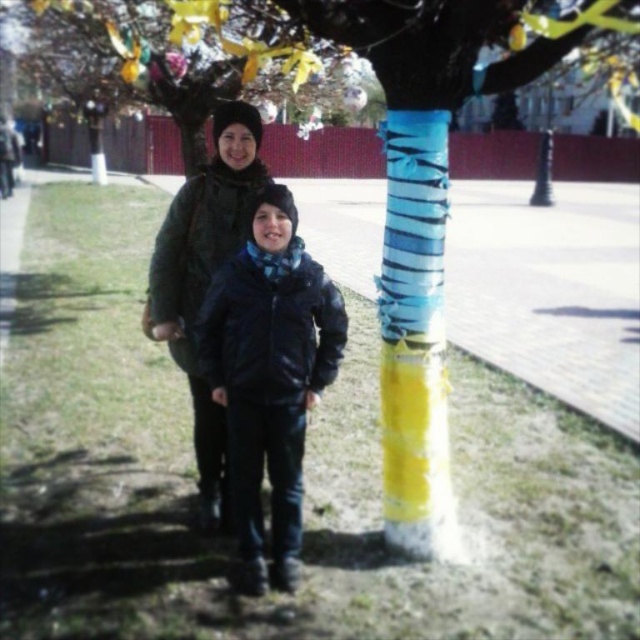
Between decorative painted tree trunk at center and glossy black jacket at center, which one is positioned lower?

Positioned lower is glossy black jacket at center.

Is point (196, 138) closer to camera compared to point (227, 438)?

No, it is behind (227, 438).

Who is more forward, (376, 170) or (291, 452)?

Point (291, 452) is more forward.

Locate an element on the screen. The height and width of the screenshot is (640, 640). decorative painted tree trunk at center is located at coordinates (196, 77).

Describe the element at coordinates (196, 77) in the screenshot. The image size is (640, 640). I see `decorative painted tree trunk at center` at that location.

Looking at this image, can you confirm if decorative painted tree trunk at center is positioned below matte black jacket at center?

Incorrect, decorative painted tree trunk at center is not positioned below matte black jacket at center.

At what (x,y) coordinates should I click in order to perform the action: click on decorative painted tree trunk at center. Please return your answer as a coordinate pair (x, y). This screenshot has width=640, height=640. Looking at the image, I should click on (196, 77).

This screenshot has height=640, width=640. Find the location of `decorative painted tree trunk at center`. decorative painted tree trunk at center is located at coordinates click(196, 77).

Can you confirm if glossy black jacket at center is positioned to the left of matte black jacket at center?

In fact, glossy black jacket at center is to the right of matte black jacket at center.

Which of these two, glossy black jacket at center or matte black jacket at center, stands shorter?

Standing shorter between the two is glossy black jacket at center.

Where is `glossy black jacket at center`? This screenshot has width=640, height=640. glossy black jacket at center is located at coordinates (269, 376).

You are a GUI agent. You are given a task and a screenshot of the screen. Output one action in this format:
    pyautogui.click(x=<x>, y=<y>)
    Task: Click on the glossy black jacket at center
    This screenshot has height=640, width=640.
    Given the screenshot: What is the action you would take?
    pyautogui.click(x=269, y=376)